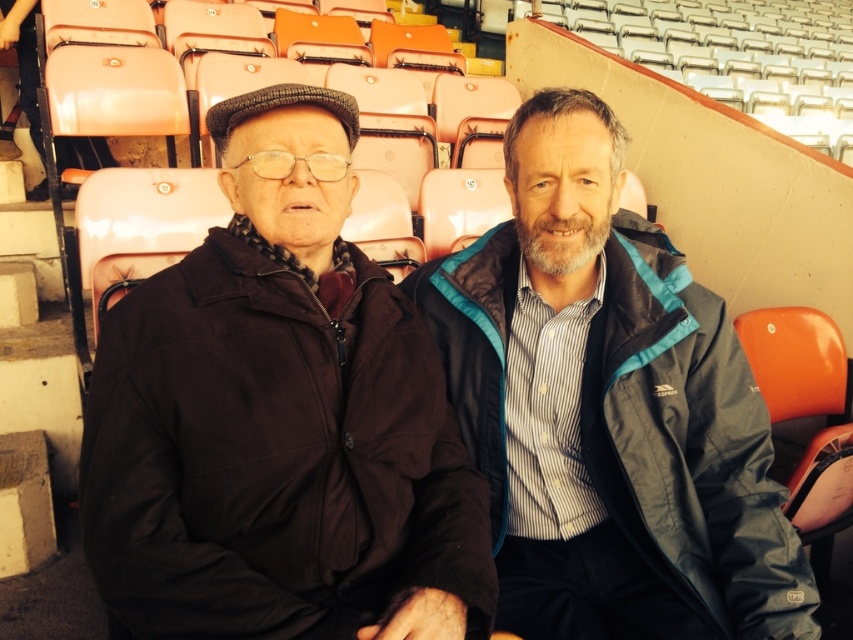
You are a photographer trying to capture both the dark brown fabric jacket at left and the blue fabric jacket at center in a single shot. Based on their positions, can you determine which jacket is closer to the camera?

The dark brown fabric jacket at left is above the blue fabric jacket at center, which means it is positioned higher in the frame. In most photographic setups, objects higher in the frame are typically closer to the camera. Therefore, the dark brown fabric jacket at left is closer to the camera than the blue fabric jacket at center.

You are trying to decide which jacket to choose for a cold day. The dark brown fabric jacket at left and the blue fabric jacket at center are both options. Based on their sizes, which one might be more suitable if you prefer a roomier fit?

The blue fabric jacket at center has a greater width than the dark brown fabric jacket at left, so it would provide a roomier fit and be more suitable if you prefer that.

You are a photographer positioned at the center of the stadium. You need to focus your camera on the dark brown fabric jacket at left. What are the coordinates of the jacket to adjust your camera lens?

The coordinates of the dark brown fabric jacket at left are at point (279, 419). Adjust your camera lens to this location to focus on it.